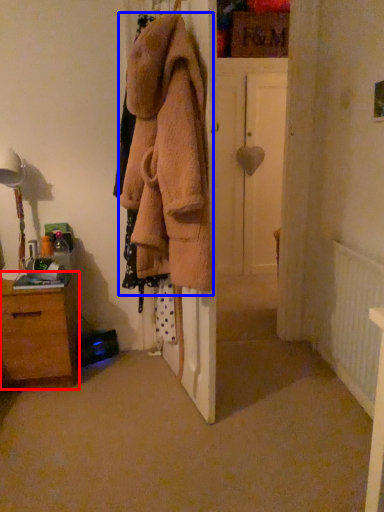
Question: Which of the following is the closest to the observer, chest of drawers (highlighted by a red box) or clothing (highlighted by a blue box)?

Choices:
 (A) chest of drawers
 (B) clothing

Answer: (B)